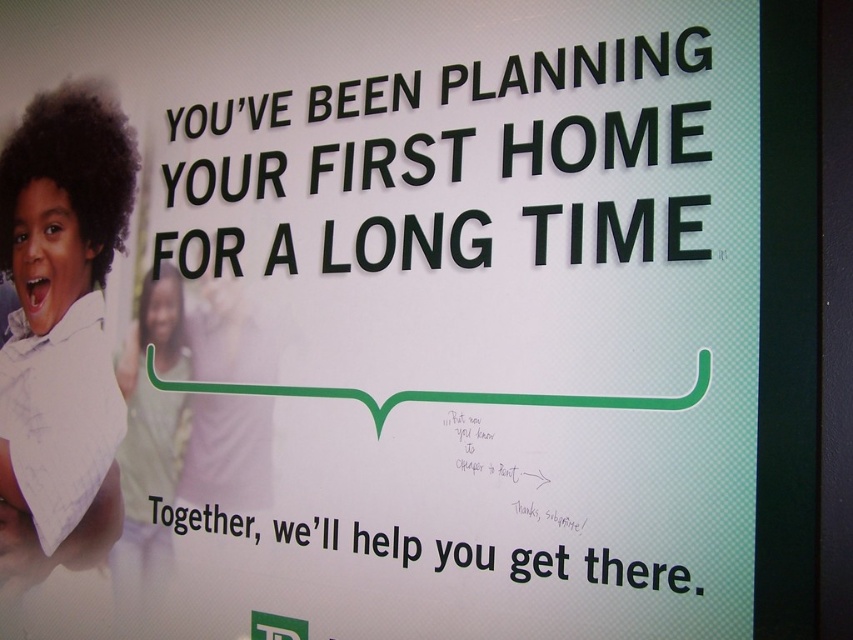
Is black plastic text at upper center smaller than black curly hair at upper left?

No.

Which is above, black plastic text at upper center or black curly hair at upper left?

Positioned higher is black plastic text at upper center.

Between point (569, 60) and point (183, 301), which one is positioned in front?

Point (569, 60)

Locate an element on the screen. Image resolution: width=853 pixels, height=640 pixels. black plastic text at upper center is located at coordinates [584, 65].

Between point (49, 321) and point (164, 490), which one is positioned behind?

Point (49, 321)

Locate an element on the screen. Image resolution: width=853 pixels, height=640 pixels. matte white shirt at left is located at coordinates (61, 301).

Where is `matte white shirt at left`? matte white shirt at left is located at coordinates (61, 301).

Does light green fabric at left appear over black curly hair at upper left?

Actually, light green fabric at left is below black curly hair at upper left.

Does point (166, 442) lie in front of point (178, 310)?

Yes, it is in front of point (178, 310).

Where is `light green fabric at left`? The image size is (853, 640). light green fabric at left is located at coordinates (149, 445).